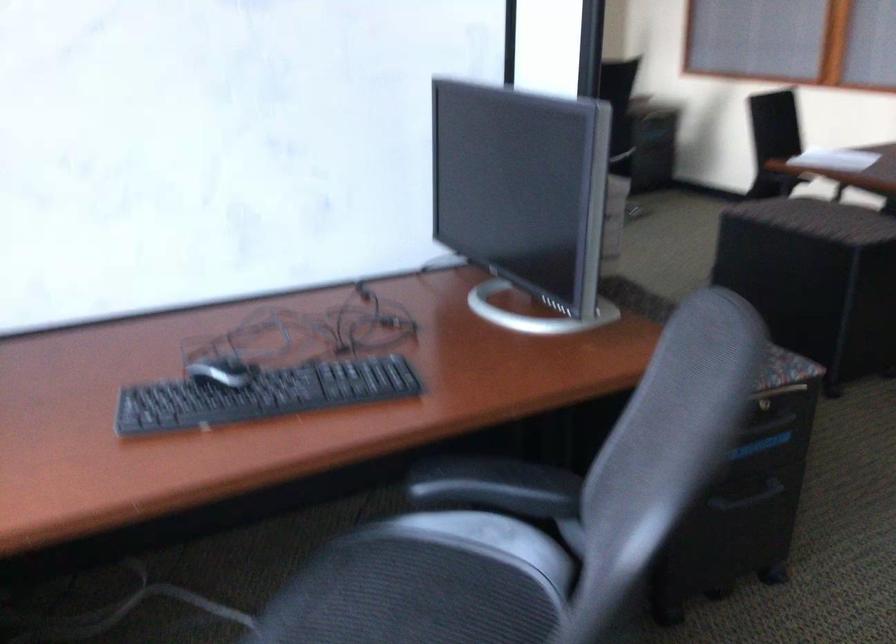
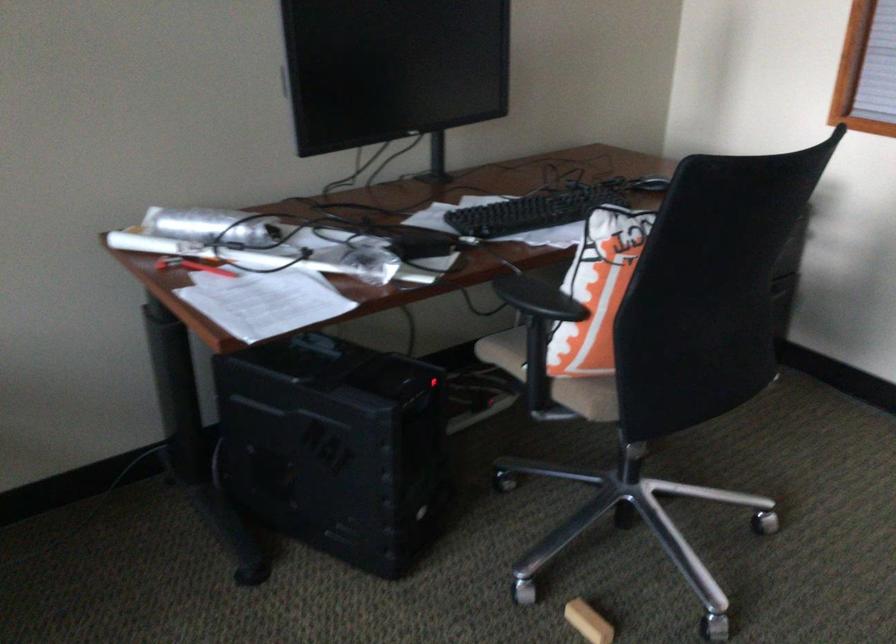
In the second image, find the point that corresponds to [607,68] in the first image.

(597, 290)